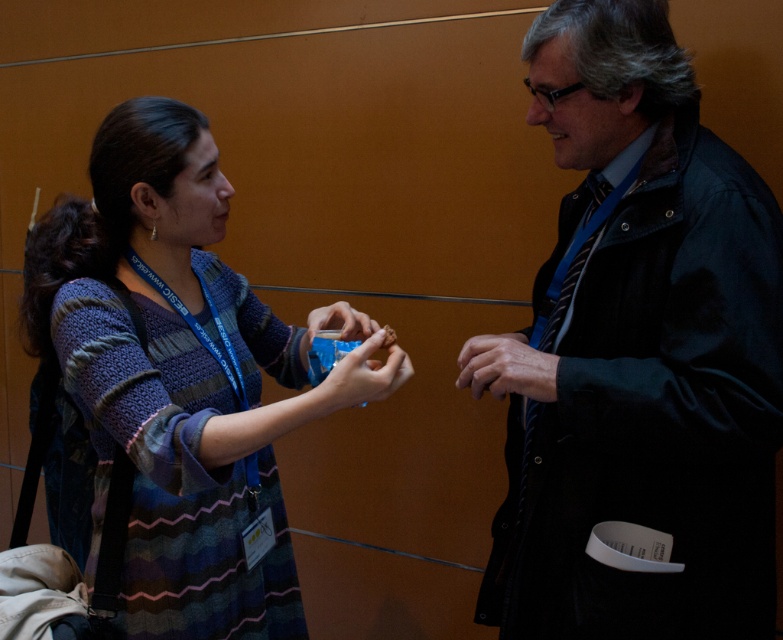
Question: Is dry skin at center closer to the viewer compared to matte plastic cookie at center?

Choices:
 (A) no
 (B) yes

Answer: (B)

Question: Can you confirm if knitted sweater at center is positioned to the left of dry skin at center?

Choices:
 (A) no
 (B) yes

Answer: (B)

Question: Is knitted sweater at center further to camera compared to matte plastic cup at center?

Choices:
 (A) no
 (B) yes

Answer: (A)

Question: Which of these objects is positioned closest to the knitted sweater at center?

Choices:
 (A) matte plastic cookie at center
 (B) matte plastic cup at center

Answer: (A)

Question: Among these objects, which one is farthest from the camera?

Choices:
 (A) matte plastic cup at center
 (B) dark blue jacket at center
 (C) dry skin at center
 (D) matte plastic cookie at center

Answer: (A)

Question: Which object is closer to the camera taking this photo?

Choices:
 (A) matte plastic cookie at center
 (B) knitted sweater at center
 (C) dry skin at center
 (D) dark blue jacket at center

Answer: (D)